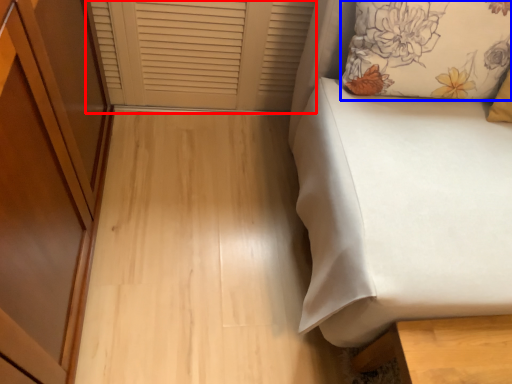
Question: Which object is closer to the camera taking this photo, window frame (highlighted by a red box) or pillow (highlighted by a blue box)?

Choices:
 (A) window frame
 (B) pillow

Answer: (B)